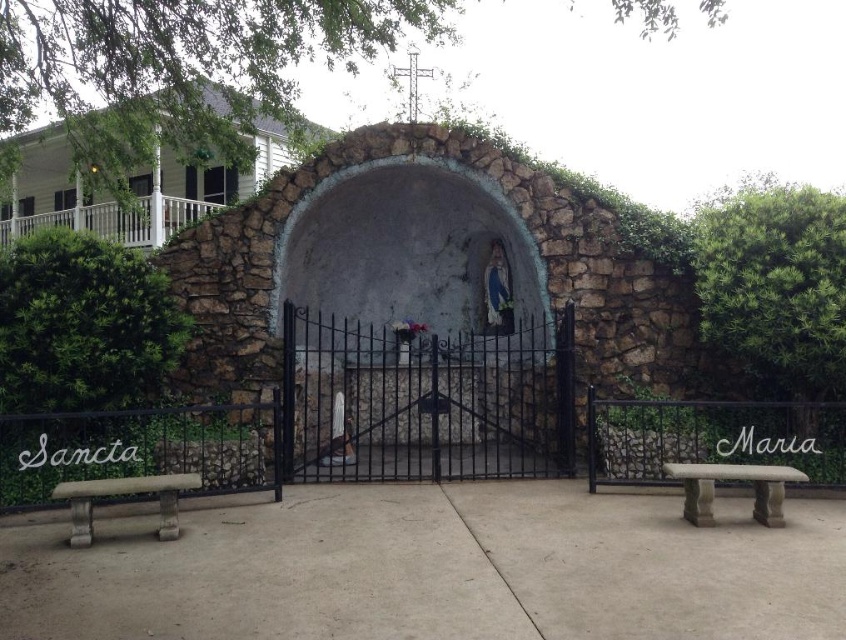
Question: Can you confirm if stone bench at lower right is positioned to the right of stone bench at lower left?

Choices:
 (A) no
 (B) yes

Answer: (B)

Question: Among these objects, which one is nearest to the camera?

Choices:
 (A) stone bench at lower right
 (B) stone bench at lower left
 (C) stone wall at upper left

Answer: (B)

Question: Estimate the real-world distances between objects in this image. Which object is farther from the stone bench at lower right?

Choices:
 (A) stone wall at upper left
 (B) stone bench at lower left

Answer: (A)

Question: Can you confirm if stone wall at upper left is bigger than stone bench at lower right?

Choices:
 (A) yes
 (B) no

Answer: (A)

Question: Which point is farther to the camera?

Choices:
 (A) (86, 486)
 (B) (732, 476)
 (C) (147, 232)

Answer: (C)

Question: Is stone bench at lower right wider than stone bench at lower left?

Choices:
 (A) no
 (B) yes

Answer: (A)